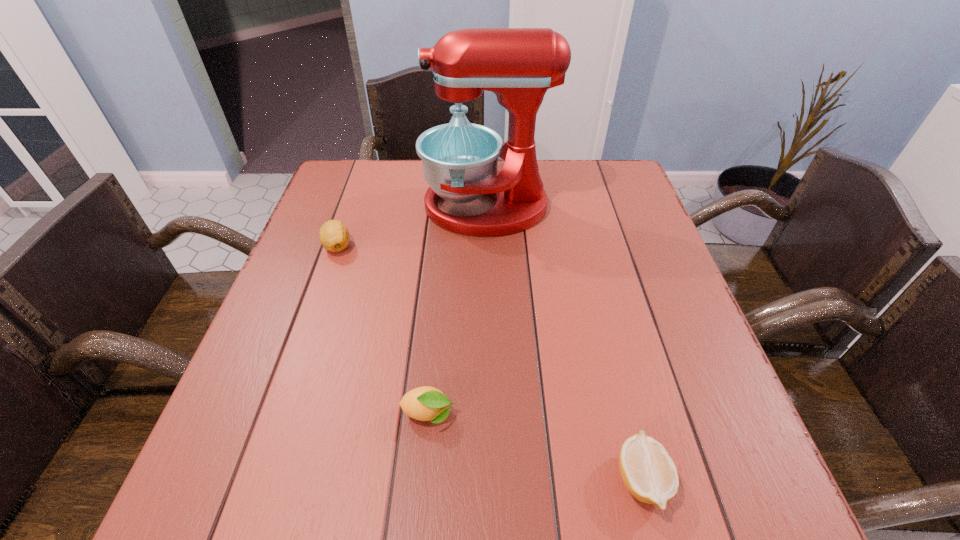
Image resolution: width=960 pixels, height=540 pixels. Find the location of `free space between the mixer and the nearest object`. free space between the mixer and the nearest object is located at coordinates (564, 343).

Locate an element on the screen. The height and width of the screenshot is (540, 960). free space that is in between the nearest object and the leftmost object is located at coordinates (490, 362).

Image resolution: width=960 pixels, height=540 pixels. I want to click on free spot between the mixer and the third farthest object, so click(458, 310).

In order to click on vacant space that's between the mixer and the second lemon from right to left in this screenshot , I will do `click(458, 310)`.

Locate which object ranks in proximity to the rightmost lemon. Please provide its 2D coordinates. Your answer should be formatted as a tuple, i.e. [(x, y)], where the tuple contains the x and y coordinates of a point satisfying the conditions above.

[(425, 403)]

Find the location of `object that is the third closest to the rightmost object`. object that is the third closest to the rightmost object is located at coordinates (x=334, y=236).

The height and width of the screenshot is (540, 960). I want to click on lemon identified as the closest to the shortest lemon, so click(425, 403).

You are a GUI agent. You are given a task and a screenshot of the screen. Output one action in this format:
    pyautogui.click(x=<x>, y=<y>)
    Task: Click on the lemon object that ranks as the closest to the third farthest object
    
    Given the screenshot: What is the action you would take?
    pyautogui.click(x=648, y=472)

The image size is (960, 540). Identify the location of free region that satisfies the following two spatial constraints: 1. on the front-facing side of the mixer; 2. at the stem end of the leftmost lemon. (488, 246).

Locate an element on the screen. Image resolution: width=960 pixels, height=540 pixels. free space that satisfies the following two spatial constraints: 1. on the back side of the rightmost object; 2. with leaves positioned above the second nearest lemon is located at coordinates (625, 414).